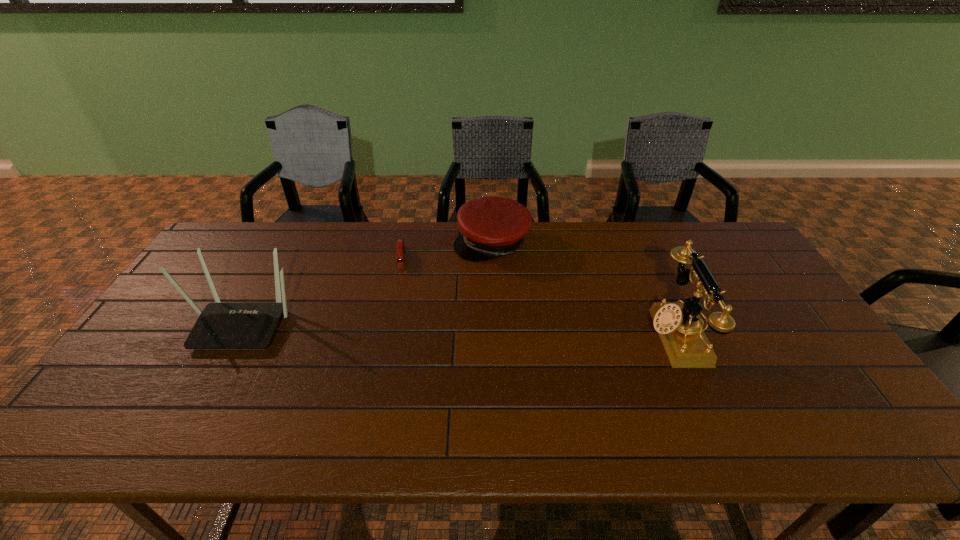
Locate an element on the screen. This screenshot has height=540, width=960. object located at the near edge is located at coordinates (677, 323).

You are a GUI agent. You are given a task and a screenshot of the screen. Output one action in this format:
    pyautogui.click(x=<x>, y=<y>)
    Task: Click on the object that is at the left edge
    
    Given the screenshot: What is the action you would take?
    pyautogui.click(x=220, y=325)

You are a GUI agent. You are given a task and a screenshot of the screen. Output one action in this format:
    pyautogui.click(x=<x>, y=<y>)
    Task: Click on the free space at the far edge of the desktop
    This screenshot has height=540, width=960.
    Given the screenshot: What is the action you would take?
    pyautogui.click(x=294, y=225)

In the image, there is a desktop. In order to click on vacant region at the near edge in this screenshot , I will do `click(225, 383)`.

The height and width of the screenshot is (540, 960). I want to click on vacant region at the right edge, so click(732, 290).

Where is `vacant position at the far right corner of the desktop`? vacant position at the far right corner of the desktop is located at coordinates (707, 254).

The width and height of the screenshot is (960, 540). What are the coordinates of `free point between the rightmost object and the stapler` in the screenshot? It's located at (539, 296).

Where is `unoccupied position between the telephone and the second shortest object`? The image size is (960, 540). unoccupied position between the telephone and the second shortest object is located at coordinates (584, 289).

I want to click on vacant area that lies between the router and the rightmost object, so click(x=459, y=329).

I want to click on free space that is in between the cap and the third shortest object, so click(368, 283).